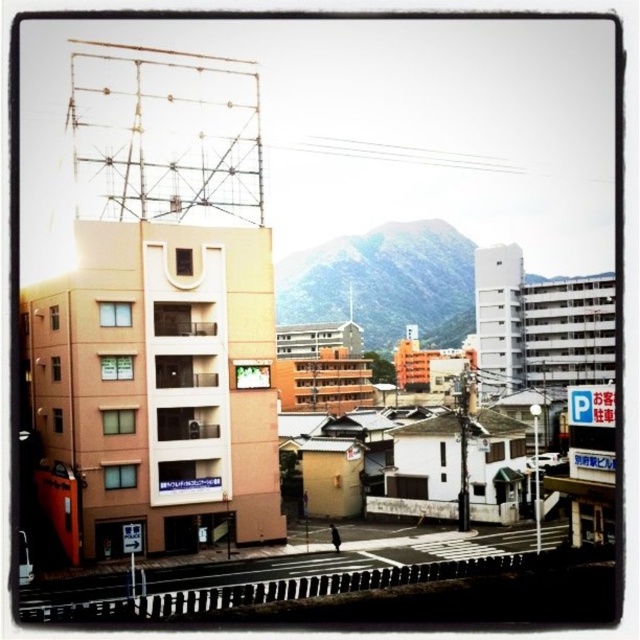
You are standing at the pedestrian crossing and want to walk towards the green matte mountain at center. Which direction should you turn to avoid the black asphalt train track at lower left?

To walk towards the green matte mountain at center while avoiding the black asphalt train track at lower left, you should turn to your right. The green matte mountain at center is positioned to the right of the black asphalt train track at lower left, so turning right will direct you away from the tracks and towards the mountain.

You are a photographer standing at the pedestrian crossing and want to capture both the green matte mountain at center and the black asphalt train track at lower left in your shot. Which object will appear closer to you in the photo?

The green matte mountain at center will appear closer to you in the photo because it is further to the viewer than the black asphalt train track at lower left.

You are standing at the pedestrian crosswalk and want to take a photo of both the modern peach building and the traditional Japanese roofs. Which point should you stand closer to to ensure both are in frame? The options are point A at coordinates point[564,276] and point B at coordinates point[452,570]. Please choose between point A or point B.

You should stand closer to point B at coordinates point[452,570] because point A is behind point B, so standing closer to point B would allow you to see both the modern peach building and the traditional Japanese roofs without obstruction.